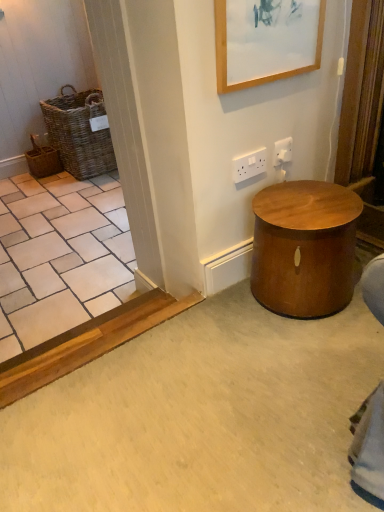
Locate an element on the screen. The height and width of the screenshot is (512, 384). free spot in front of shiny brown stool at lower right is located at coordinates (308, 353).